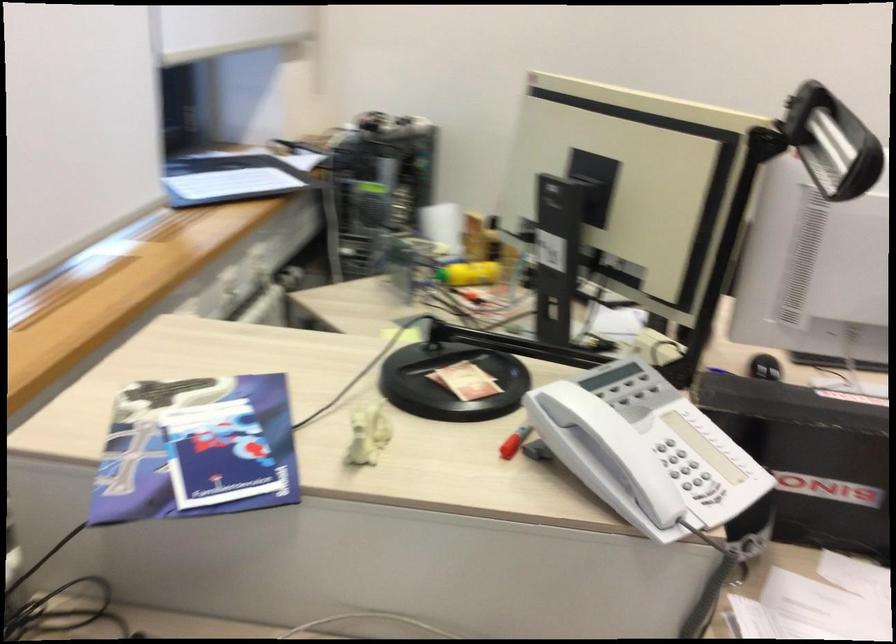
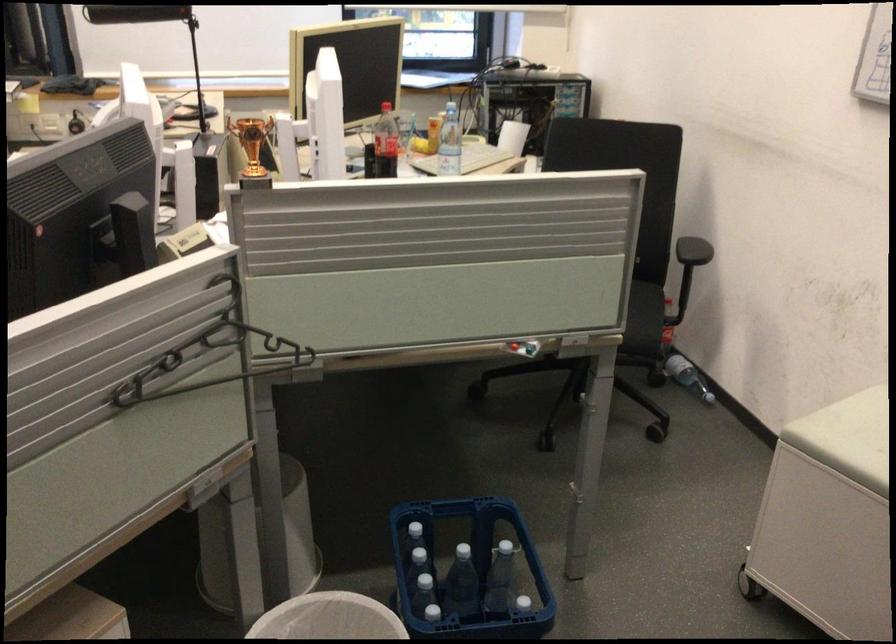
Question: I am providing you with two images of the same scene from different viewpoints. Which of the following objects are not visible in image2?

Choices:
 (A) red button
 (B) chair sitting surface
 (C) small white figurine
 (D) tan sandal

Answer: (C)